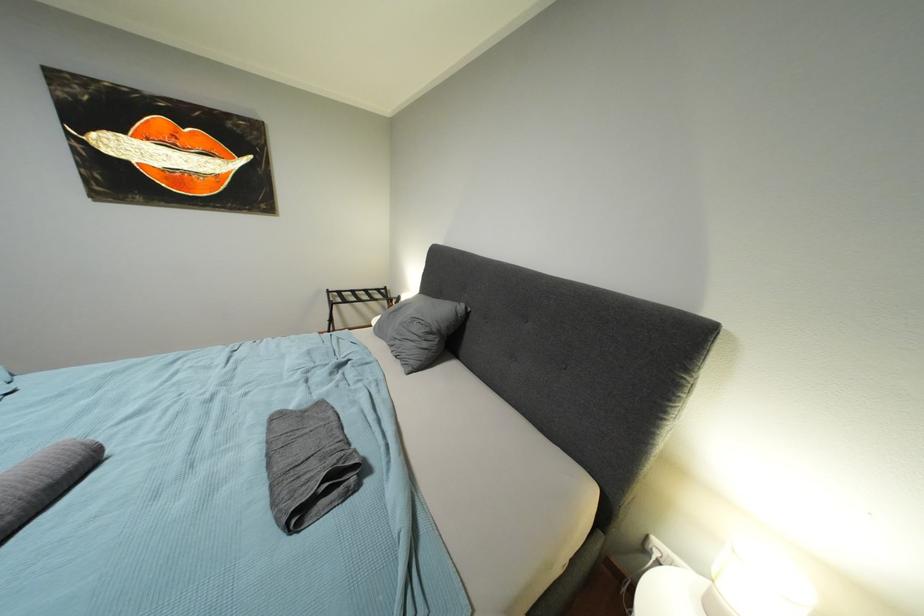
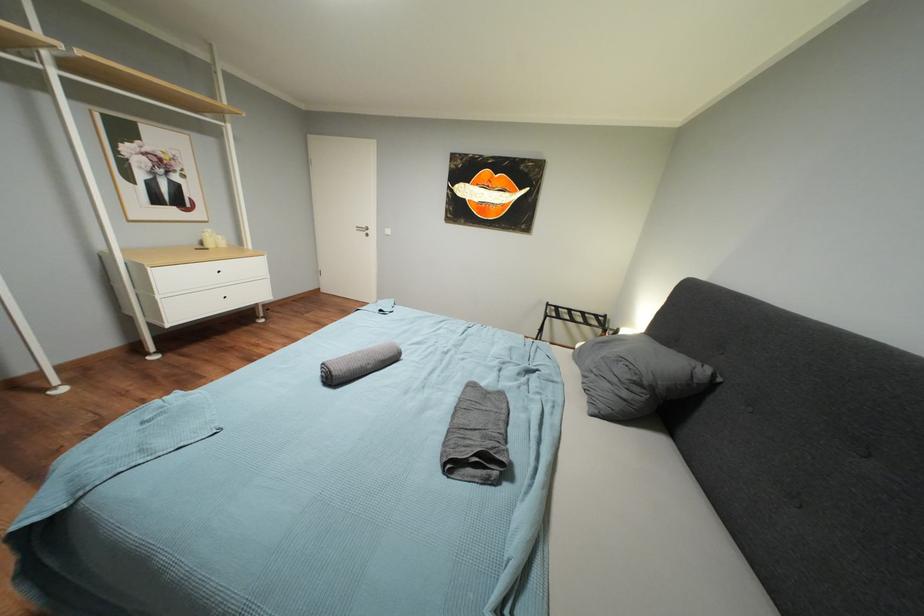
Question: Based on the continuous images, in which direction is the camera rotating? Reply with the corresponding letter.

Choices:
 (A) Left
 (B) Right
 (C) Up
 (D) Down

Answer: (A)